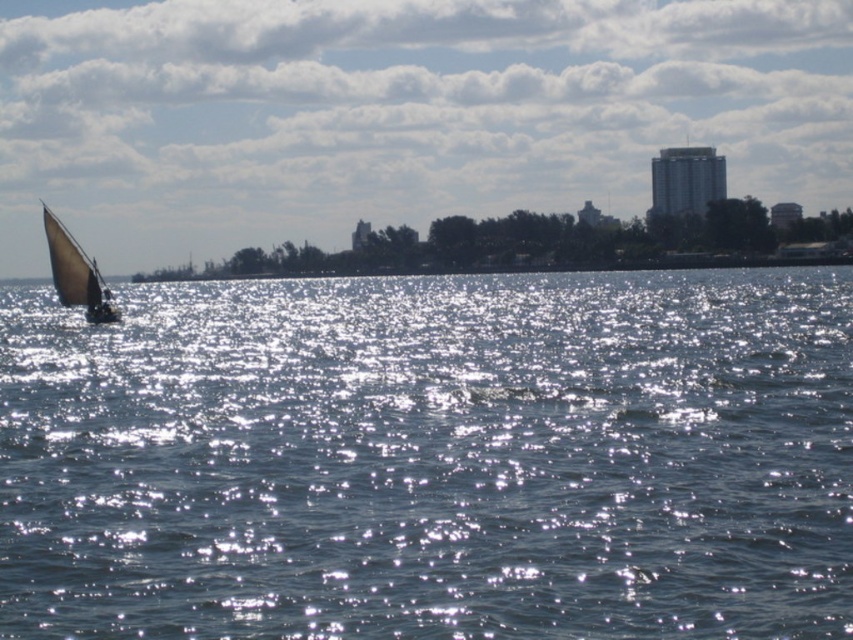
Question: Observing the image, what is the correct spatial positioning of matte white sailboat at left in reference to white canvas sail at left?

Choices:
 (A) above
 (B) below

Answer: (A)

Question: Does blue water at left come behind matte white sailboat at left?

Choices:
 (A) yes
 (B) no

Answer: (B)

Question: Which point is farther to the camera?

Choices:
 (A) (300, 196)
 (B) (61, 225)
 (C) (334, 304)

Answer: (A)

Question: Among these objects, which one is farthest from the camera?

Choices:
 (A) matte white sailboat at left
 (B) white canvas sail at left
 (C) blue water at left

Answer: (A)

Question: Among these objects, which one is farthest from the camera?

Choices:
 (A) matte white sailboat at left
 (B) blue water at left

Answer: (A)

Question: Is blue water at left smaller than white canvas sail at left?

Choices:
 (A) no
 (B) yes

Answer: (A)